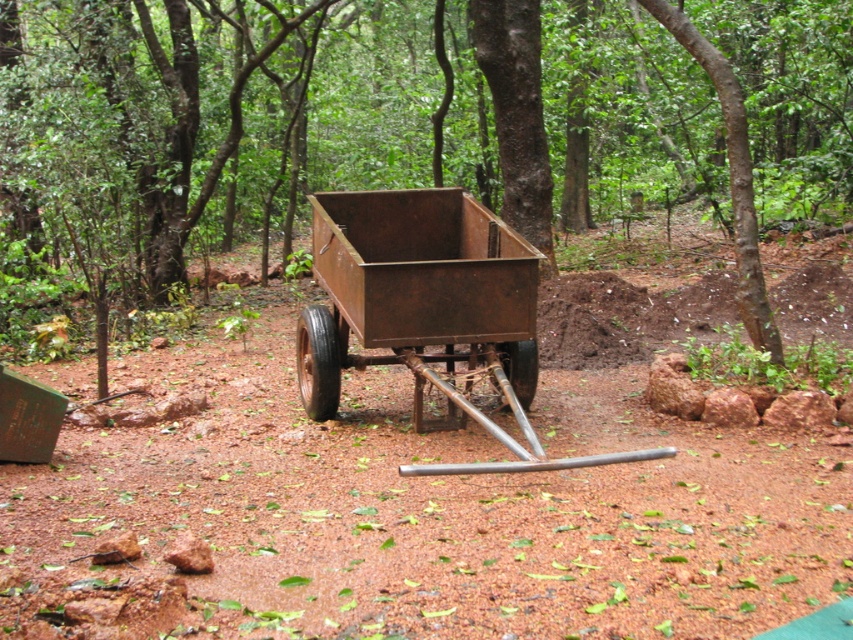
You are a hiker who needs to decide which of the two metal objects at the center of the forest scene can fit through a narrow cave entrance that is 1.2 meters in height. The objects are the rusty metal cart at center and the rusty metal wagon at center. Which one can pass through?

The rusty metal wagon at center can pass through the cave entrance since it is shorter than the rusty metal cart at center, and the entrance is 1.2 meters tall.

You are a hiker who needs to decide which of the two items, the rusty metal cart at center or the rusty metal wagon at center, can carry more items. Based on their sizes, which one can hold more?

The rusty metal cart at center has a greater width than the rusty metal wagon at center, so it can hold more items.

You are a hiker carrying a backpack weighing 5 kilograms. You need to move from the rusty metal cart at center to the rusty metal wagon at center. Can you walk directly between them without any obstacles?

The distance between the rusty metal cart at center and the rusty metal wagon at center is 6.77 meters. Since there are no obstacles mentioned in the scene description, you can walk directly between them.